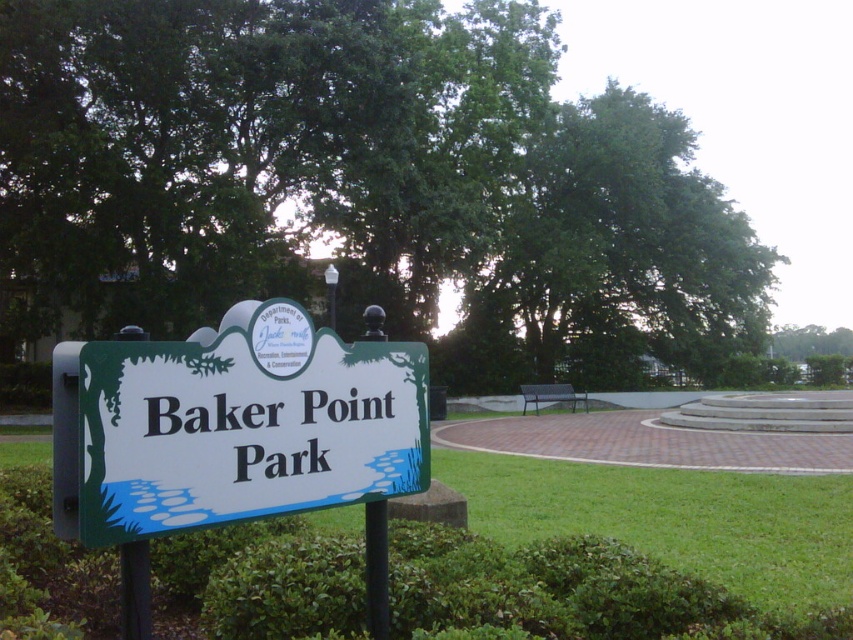
Question: Which of the following is the farthest from the observer?

Choices:
 (A) green leafy tree at center
 (B) green plastic sign at center

Answer: (A)

Question: Can you confirm if green leafy tree at center is positioned below green plastic sign at center?

Choices:
 (A) yes
 (B) no

Answer: (B)

Question: Can you confirm if green leafy tree at center is positioned to the right of green plastic sign at center?

Choices:
 (A) yes
 (B) no

Answer: (A)

Question: Where is green leafy tree at center located in relation to green plastic sign at center in the image?

Choices:
 (A) below
 (B) above

Answer: (B)